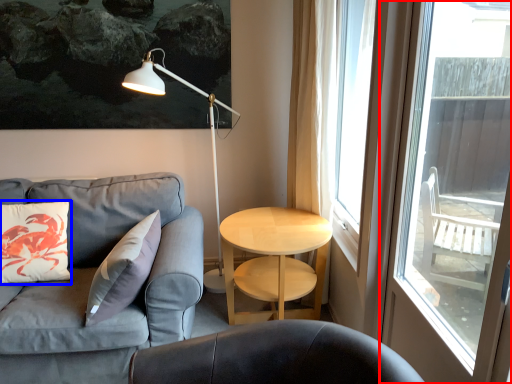
Question: Which object is further to the camera taking this photo, window (highlighted by a red box) or pillow (highlighted by a blue box)?

Choices:
 (A) window
 (B) pillow

Answer: (B)